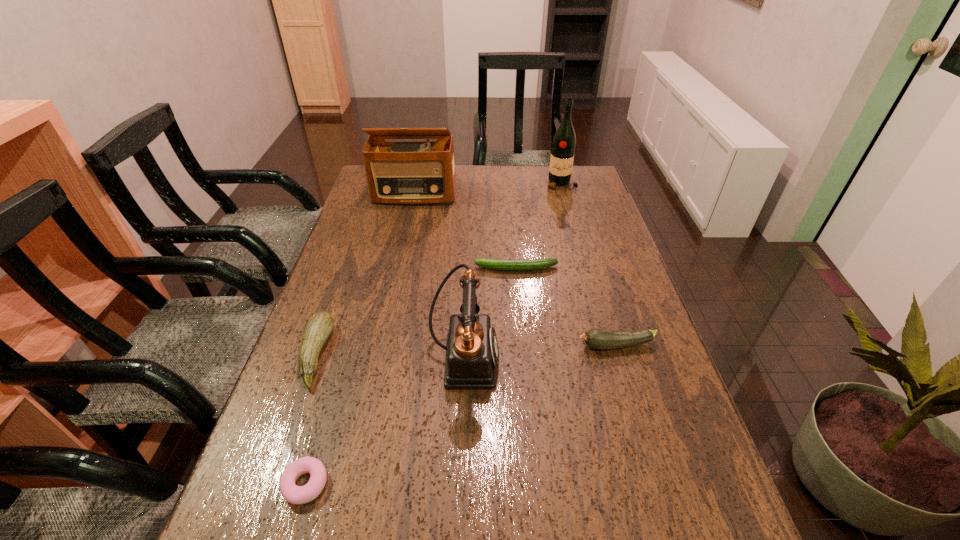
Where is `vacant space positioned on the surface of the wine bottle`? The image size is (960, 540). vacant space positioned on the surface of the wine bottle is located at coordinates (577, 240).

Locate an element on the screen. The width and height of the screenshot is (960, 540). free location located on the front panel of the radio receiver is located at coordinates (410, 214).

At what (x,y) coordinates should I click in order to perform the action: click on vacant point located on the front of the third tallest object at the rotary dial. Please return your answer as a coordinate pair (x, y). This screenshot has height=540, width=960. Looking at the image, I should click on (547, 358).

Locate an element on the screen. This screenshot has height=540, width=960. vacant area situated at the stem end of the fourth shortest object is located at coordinates (359, 355).

Where is `vacant position located at the blossom end of the second tallest zucchini`? The image size is (960, 540). vacant position located at the blossom end of the second tallest zucchini is located at coordinates (407, 346).

Identify the location of vacant space located at the blossom end of the second tallest zucchini. The height and width of the screenshot is (540, 960). (479, 346).

The image size is (960, 540). What are the coordinates of `free space located at the blossom end of the second tallest zucchini` in the screenshot? It's located at (539, 346).

Locate an element on the screen. This screenshot has height=540, width=960. vacant space located 0.270m on the front-facing side of the third farthest object is located at coordinates (379, 268).

The width and height of the screenshot is (960, 540). I want to click on vacant position located 0.230m on the front-facing side of the third farthest object, so click(393, 268).

Identify the location of vacant region located on the front-facing side of the third farthest object. The width and height of the screenshot is (960, 540). point(443,268).